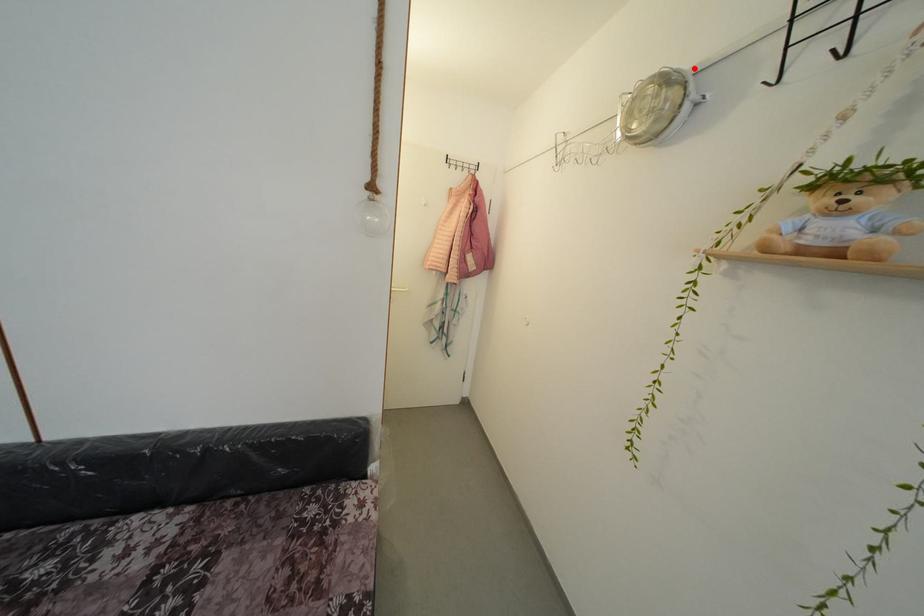
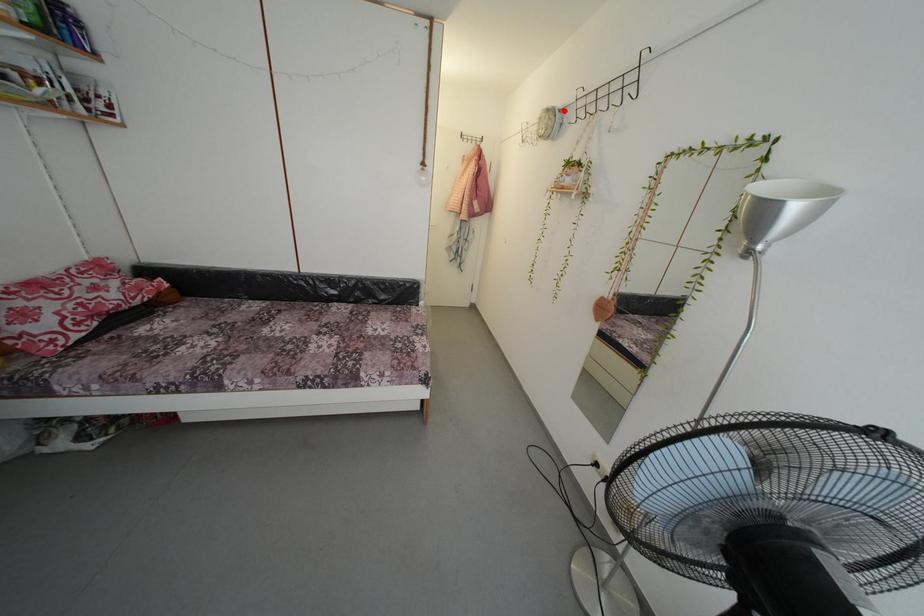
I am providing you with two images of the same scene from different viewpoints. A red point is marked on the first image and another point is marked on the second image. Does the point marked in image1 correspond to the same location as the one in image2?

Yes